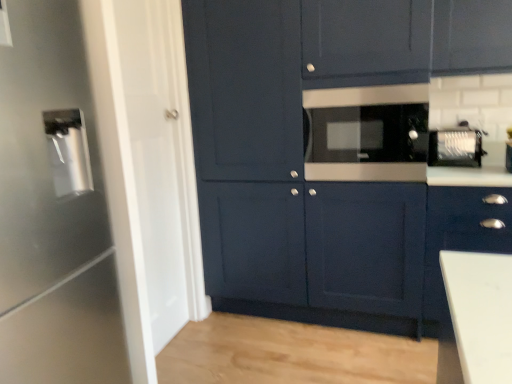
Image resolution: width=512 pixels, height=384 pixels. Describe the element at coordinates (366, 133) in the screenshot. I see `satin black microwave at center, which is the 2th appliance from front to back` at that location.

At what (x,y) coordinates should I click in order to perform the action: click on satin black microwave at center, the second appliance when ordered from left to right. Please return your answer as a coordinate pair (x, y). This screenshot has width=512, height=384. Looking at the image, I should click on (366, 133).

Is matte dark blue cabinet at center, which is counted as the 2th cabinetry, starting from the right, surrounded by satin silver water dispenser at left, which is counted as the 3th appliance, starting from the right?

No, satin silver water dispenser at left, which is counted as the 3th appliance, starting from the right, does not contain matte dark blue cabinet at center, which is counted as the 2th cabinetry, starting from the right.

At what (x,y) coordinates should I click in order to perform the action: click on appliance on the left of matte dark blue cabinet at center, which is counted as the 2th cabinetry, starting from the right. Please return your answer as a coordinate pair (x, y). The image size is (512, 384). Looking at the image, I should click on (66, 207).

From a real-world perspective, between satin silver water dispenser at left, which is counted as the 3th appliance, starting from the right, and matte dark blue cabinet at center, arranged as the first cabinetry when viewed from the left, who is vertically lower?

satin silver water dispenser at left, which is counted as the 3th appliance, starting from the right.

Which is more to the right, satin silver toaster at upper right, the first appliance viewed from the back, or matte dark blue cabinet at center, which is counted as the 2th cabinetry, starting from the right?

From the viewer's perspective, satin silver toaster at upper right, the first appliance viewed from the back, appears more on the right side.

Can you confirm if satin silver toaster at upper right, which ranks as the 3th appliance in front-to-back order, is wider than matte dark blue cabinet at center, which is counted as the 2th cabinetry, starting from the right?

Incorrect, the width of satin silver toaster at upper right, which ranks as the 3th appliance in front-to-back order, does not surpass that of matte dark blue cabinet at center, which is counted as the 2th cabinetry, starting from the right.

Which is behind, satin silver toaster at upper right, which ranks as the 3th appliance in front-to-back order, or matte dark blue cabinet at center, which is counted as the 2th cabinetry, starting from the right?

Positioned behind is satin silver toaster at upper right, which ranks as the 3th appliance in front-to-back order.

Is satin silver toaster at upper right, which ranks as the 3th appliance in left-to-right order, facing away from matte dark blue cabinet at center, which is counted as the 2th cabinetry, starting from the right?

No, satin silver toaster at upper right, which ranks as the 3th appliance in left-to-right order,'s orientation is not away from matte dark blue cabinet at center, which is counted as the 2th cabinetry, starting from the right.

Can you confirm if satin black microwave at center, the second appliance from the back, is thinner than matte dark blue cabinet at lower right, which is the second cabinetry from left to right?

Yes, satin black microwave at center, the second appliance from the back, is thinner than matte dark blue cabinet at lower right, which is the second cabinetry from left to right.

Is point (322, 125) farther from viewer compared to point (471, 251)?

Yes, it is.

Does satin black microwave at center, the second appliance when ordered from right to left, turn towards matte dark blue cabinet at lower right, which is the second cabinetry from left to right?

No, satin black microwave at center, the second appliance when ordered from right to left, is not oriented towards matte dark blue cabinet at lower right, which is the second cabinetry from left to right.

Would you say satin black microwave at center, which is the 2th appliance from front to back, is to the left or to the right of matte dark blue cabinet at lower right, acting as the 1th cabinetry starting from the right, in the picture?

Clearly, satin black microwave at center, which is the 2th appliance from front to back, is on the left of matte dark blue cabinet at lower right, acting as the 1th cabinetry starting from the right, in the image.

Between satin black microwave at center, the second appliance when ordered from left to right, and matte dark blue cabinet at center, which is counted as the 2th cabinetry, starting from the right, which one appears on the right side from the viewer's perspective?

satin black microwave at center, the second appliance when ordered from left to right.

Is matte dark blue cabinet at center, arranged as the first cabinetry when viewed from the left, at the back of satin black microwave at center, the second appliance when ordered from left to right?

Yes, satin black microwave at center, the second appliance when ordered from left to right, is facing away from matte dark blue cabinet at center, arranged as the first cabinetry when viewed from the left.

Is the position of satin black microwave at center, the second appliance when ordered from left to right, less distant than that of matte dark blue cabinet at center, which is counted as the 2th cabinetry, starting from the right?

That is False.

Does matte dark blue cabinet at center, arranged as the first cabinetry when viewed from the left, come behind satin black microwave at center, the second appliance when ordered from left to right?

No, it is in front of satin black microwave at center, the second appliance when ordered from left to right.

From a real-world perspective, is matte dark blue cabinet at center, arranged as the first cabinetry when viewed from the left, located beneath satin black microwave at center, the second appliance when ordered from left to right?

Indeed, from a real-world perspective, matte dark blue cabinet at center, arranged as the first cabinetry when viewed from the left, is positioned beneath satin black microwave at center, the second appliance when ordered from left to right.

Is there a large distance between matte dark blue cabinet at center, arranged as the first cabinetry when viewed from the left, and satin black microwave at center, the second appliance when ordered from right to left?

matte dark blue cabinet at center, arranged as the first cabinetry when viewed from the left, is actually quite close to satin black microwave at center, the second appliance when ordered from right to left.

Does point (254, 55) appear closer or farther from the camera than point (373, 105)?

Point (254, 55) is positioned farther from the camera compared to point (373, 105).

Which object is closer to the camera, matte dark blue cabinet at lower right, acting as the 1th cabinetry starting from the right, or satin black microwave at center, the second appliance from the back?

matte dark blue cabinet at lower right, acting as the 1th cabinetry starting from the right, is in front.

Is matte dark blue cabinet at lower right, acting as the 1th cabinetry starting from the right, at the left side of satin black microwave at center, the second appliance when ordered from right to left?

In fact, matte dark blue cabinet at lower right, acting as the 1th cabinetry starting from the right, is to the right of satin black microwave at center, the second appliance when ordered from right to left.

Does matte dark blue cabinet at lower right, acting as the 1th cabinetry starting from the right, contain satin black microwave at center, the second appliance when ordered from left to right?

No, satin black microwave at center, the second appliance when ordered from left to right, is not inside matte dark blue cabinet at lower right, acting as the 1th cabinetry starting from the right.

Is matte dark blue cabinet at lower right, acting as the 1th cabinetry starting from the right, oriented towards satin black microwave at center, the second appliance when ordered from right to left?

No, matte dark blue cabinet at lower right, acting as the 1th cabinetry starting from the right, is not turned towards satin black microwave at center, the second appliance when ordered from right to left.

Which object is thinner, satin silver toaster at upper right, the 1th appliance from the right, or matte dark blue cabinet at lower right, acting as the 1th cabinetry starting from the right?

With smaller width is satin silver toaster at upper right, the 1th appliance from the right.

Which object is positioned more to the left, satin silver toaster at upper right, the 1th appliance from the right, or matte dark blue cabinet at lower right, acting as the 1th cabinetry starting from the right?

satin silver toaster at upper right, the 1th appliance from the right.

Is satin silver toaster at upper right, the first appliance viewed from the back, positioned beyond the bounds of matte dark blue cabinet at lower right, which is the second cabinetry from left to right?

Yes, satin silver toaster at upper right, the first appliance viewed from the back, is outside of matte dark blue cabinet at lower right, which is the second cabinetry from left to right.

Considering the sizes of objects satin silver toaster at upper right, the 1th appliance from the right, and matte dark blue cabinet at lower right, which is the second cabinetry from left to right, in the image provided, who is shorter, satin silver toaster at upper right, the 1th appliance from the right, or matte dark blue cabinet at lower right, which is the second cabinetry from left to right,?

satin silver toaster at upper right, the 1th appliance from the right, is shorter.

Find the location of a particular element. This screenshot has height=384, width=512. cabinetry above the satin silver water dispenser at left, which ranks as the 1th appliance in front-to-back order (from the image's perspective) is located at coordinates (336, 153).

Find the location of a particular element. This screenshot has width=512, height=384. cabinetry on the left of satin silver toaster at upper right, the first appliance viewed from the back is located at coordinates (336, 153).

From the image, which object appears to be farther from matte dark blue cabinet at lower right, which is the second cabinetry from left to right, satin silver water dispenser at left, which ranks as the 3th appliance in back-to-front order, or satin silver toaster at upper right, which ranks as the 3th appliance in left-to-right order?

Among the two, satin silver water dispenser at left, which ranks as the 3th appliance in back-to-front order, is located further to matte dark blue cabinet at lower right, which is the second cabinetry from left to right.

Which object lies further to the anchor point satin silver water dispenser at left, which is counted as the 3th appliance, starting from the right, matte dark blue cabinet at lower right, which is the second cabinetry from left to right, or satin black microwave at center, the second appliance when ordered from left to right?

The object further to satin silver water dispenser at left, which is counted as the 3th appliance, starting from the right, is matte dark blue cabinet at lower right, which is the second cabinetry from left to right.

Which object lies further to the anchor point satin black microwave at center, the second appliance when ordered from left to right, matte dark blue cabinet at lower right, acting as the 1th cabinetry starting from the right, or matte dark blue cabinet at center, arranged as the first cabinetry when viewed from the left?

matte dark blue cabinet at lower right, acting as the 1th cabinetry starting from the right, is further to satin black microwave at center, the second appliance when ordered from left to right.

Looking at the image, which one is located closer to satin silver toaster at upper right, which ranks as the 3th appliance in left-to-right order, satin silver water dispenser at left, which ranks as the 3th appliance in back-to-front order, or matte dark blue cabinet at lower right, acting as the 1th cabinetry starting from the right?

The object closer to satin silver toaster at upper right, which ranks as the 3th appliance in left-to-right order, is matte dark blue cabinet at lower right, acting as the 1th cabinetry starting from the right.

Based on the photo, estimate the real-world distances between objects in this image. Which object is further from matte dark blue cabinet at center, which is counted as the 2th cabinetry, starting from the right, matte dark blue cabinet at lower right, which is the second cabinetry from left to right, or satin black microwave at center, the second appliance when ordered from right to left?

matte dark blue cabinet at lower right, which is the second cabinetry from left to right, is further to matte dark blue cabinet at center, which is counted as the 2th cabinetry, starting from the right.

Which object lies further to the anchor point satin silver water dispenser at left, which is counted as the 3th appliance, starting from the right, satin black microwave at center, the second appliance when ordered from left to right, or matte dark blue cabinet at center, which is counted as the 2th cabinetry, starting from the right?

satin black microwave at center, the second appliance when ordered from left to right, is further to satin silver water dispenser at left, which is counted as the 3th appliance, starting from the right.

Estimate the real-world distances between objects in this image. Which object is closer to matte dark blue cabinet at lower right, which is the second cabinetry from left to right, matte dark blue cabinet at center, which is counted as the 2th cabinetry, starting from the right, or satin black microwave at center, which is the 2th appliance from front to back?

satin black microwave at center, which is the 2th appliance from front to back, is closer to matte dark blue cabinet at lower right, which is the second cabinetry from left to right.

Based on their spatial positions, is matte dark blue cabinet at lower right, which is the second cabinetry from left to right, or satin silver water dispenser at left, which ranks as the 3th appliance in back-to-front order, closer to matte dark blue cabinet at center, arranged as the first cabinetry when viewed from the left?

matte dark blue cabinet at lower right, which is the second cabinetry from left to right, is closer to matte dark blue cabinet at center, arranged as the first cabinetry when viewed from the left.

Locate an element on the screen. This screenshot has height=384, width=512. appliance situated between satin silver water dispenser at left, which ranks as the 1th appliance in front-to-back order, and satin silver toaster at upper right, the first appliance viewed from the back, from left to right is located at coordinates (366, 133).

Locate an element on the screen. Image resolution: width=512 pixels, height=384 pixels. cabinetry between satin silver water dispenser at left, which ranks as the 1th appliance in front-to-back order, and matte dark blue cabinet at lower right, acting as the 1th cabinetry starting from the right, from left to right is located at coordinates (336, 153).

Image resolution: width=512 pixels, height=384 pixels. Identify the location of cabinetry between satin silver water dispenser at left, which ranks as the 3th appliance in back-to-front order, and satin silver toaster at upper right, the 1th appliance from the right, from left to right. (336, 153).

In order to click on cabinetry between satin silver water dispenser at left, which is counted as the 3th appliance, starting from the right, and satin black microwave at center, the second appliance from the back, from left to right in this screenshot , I will do `click(336, 153)`.